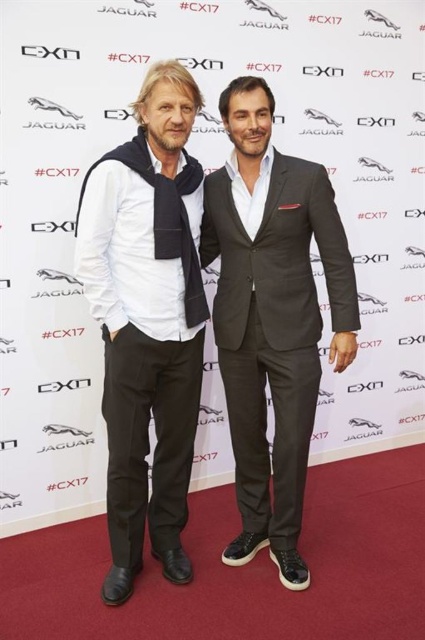
Measure the distance between matte black scarf at left and camera.

A distance of 1.86 meters exists between matte black scarf at left and camera.

Can you confirm if matte black scarf at left is positioned to the right of dark gray suit at center?

No, matte black scarf at left is not to the right of dark gray suit at center.

At what (x,y) coordinates should I click in order to perform the action: click on matte black scarf at left. Please return your answer as a coordinate pair (x, y). Image resolution: width=425 pixels, height=640 pixels. Looking at the image, I should click on (147, 321).